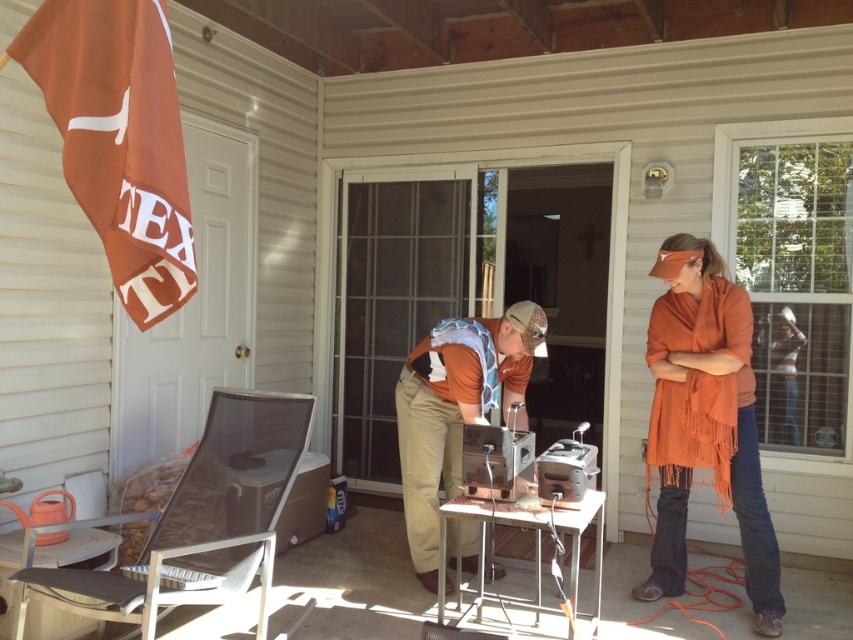
From the picture: You are a delivery person who needs to place a package on the surface that is lower between the orange fabric at center and the satin silver toaster at center. Which object should you place the package near?

The satin silver toaster at center has a lower height compared to the orange fabric at center, so you should place the package near the satin silver toaster at center.

You are a guest at this house and want to place a 15 cm tall decorative item on the porch table. The orange fringed scarf at right and the satin silver toaster at center are already on the table. Which object should you place the item next to so it won

The orange fringed scarf at right is much taller than the satin silver toaster at center, so placing the item next to the taller orange fringed scarf at right would provide more vertical space to accommodate the decorative item without overcrowding the area.

You are standing on the porch and want to place a small potted plant on the table. The table is located at coordinates approximately 0.5, 0.5 in the image. Where should you place the potted plant so it doesn not block the view of the orange fringed scarf at right? Please provide coordinates in the same format as the scarf.

The orange fringed scarf at right is located at point (705, 420). To avoid blocking its view, place the potted plant somewhere not overlapping with those coordinates, such as at (511, 256).